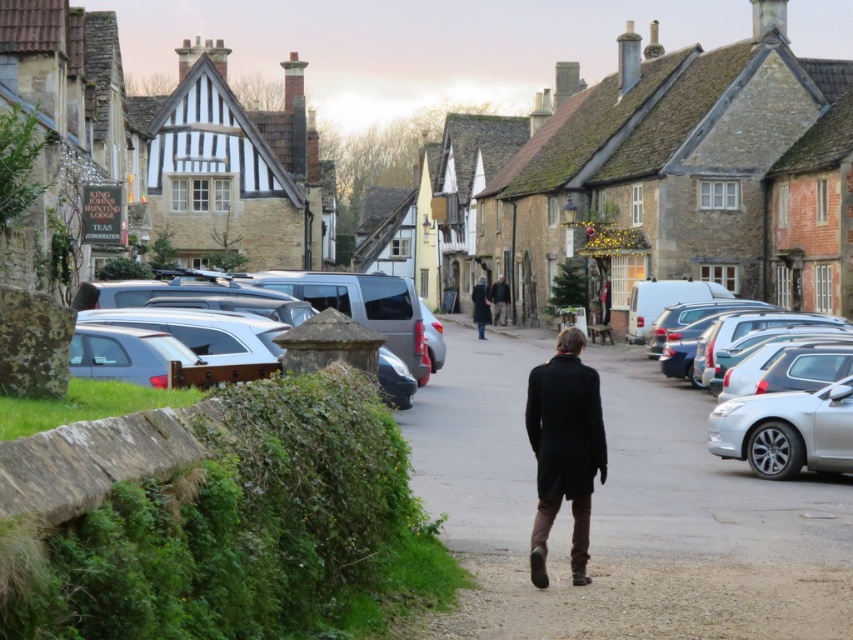
You are standing in the village square and want to take a photo of the stone village at center while also including the dark brown coat at center in the frame. Which object should you focus on first to ensure both are in focus?

You should focus on the stone village at center first because it is closer to you than the dark brown coat at center, so focusing on it will keep both objects in focus.

You are standing on the grassy area in front of the stone village at center and want to pick up the dark brown coat at center. Which direction should you move to reach the coat?

The dark brown coat at center is located below the stone village at center, so you should move downward to reach it.